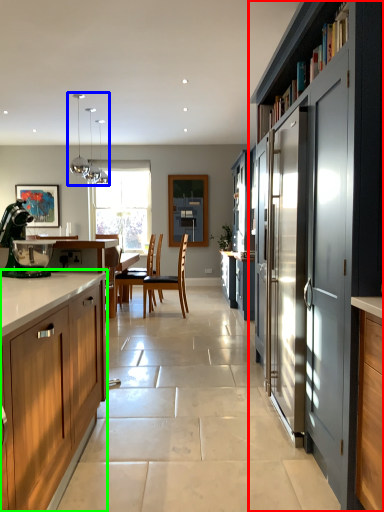
Question: Which object is the farthest from cabinetry (highlighted by a red box)? Choose among these: light fixture (highlighted by a blue box) or cabinetry (highlighted by a green box).

Choices:
 (A) light fixture
 (B) cabinetry

Answer: (A)